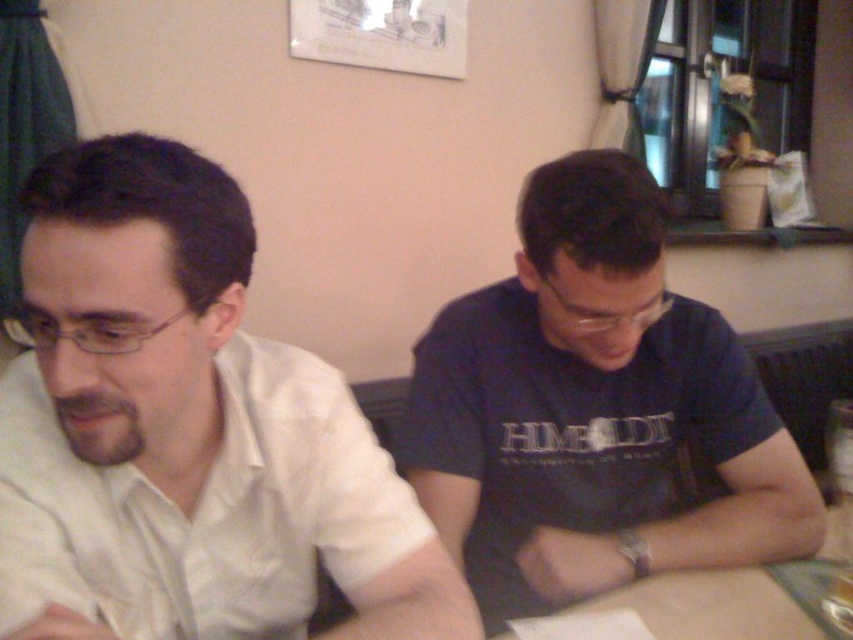
Question: Is white satin shirt at left to the left of dark blue t-shirt at center from the viewer's perspective?

Choices:
 (A) yes
 (B) no

Answer: (A)

Question: Which point appears closest to the camera in this image?

Choices:
 (A) (262, 376)
 (B) (618, 256)

Answer: (A)

Question: Which object appears closest to the camera in this image?

Choices:
 (A) white satin shirt at left
 (B) dark blue t-shirt at center

Answer: (A)

Question: Is white satin shirt at left closer to the viewer compared to dark blue t-shirt at center?

Choices:
 (A) yes
 (B) no

Answer: (A)

Question: Does white satin shirt at left have a smaller size compared to dark blue t-shirt at center?

Choices:
 (A) yes
 (B) no

Answer: (A)